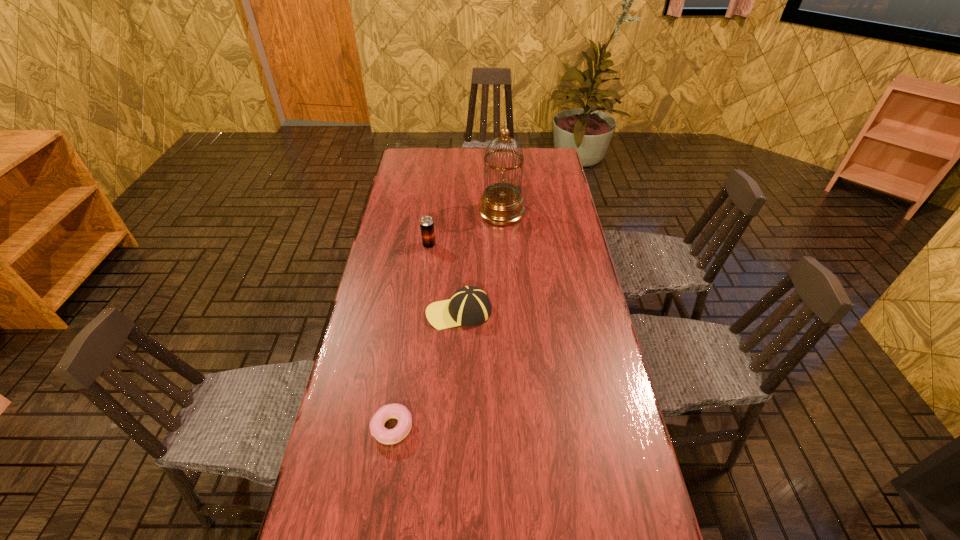
Find the location of `vacant space located 0.060m with an open door on the birdcage`. vacant space located 0.060m with an open door on the birdcage is located at coordinates click(464, 213).

The width and height of the screenshot is (960, 540). I want to click on vacant space located 0.370m on the right of the third shortest object, so click(537, 245).

The width and height of the screenshot is (960, 540). Find the location of `free point located 0.100m with the brim of the baseball cap facing forward`. free point located 0.100m with the brim of the baseball cap facing forward is located at coordinates (395, 312).

At what (x,y) coordinates should I click in order to perform the action: click on blank space located with the brim of the baseball cap facing forward. Please return your answer as a coordinate pair (x, y). Looking at the image, I should click on (407, 312).

This screenshot has width=960, height=540. I want to click on free space located with the brim of the baseball cap facing forward, so click(372, 312).

Identify the location of free space located on the back of the nearest object. (407, 330).

You are a GUI agent. You are given a task and a screenshot of the screen. Output one action in this format:
    pyautogui.click(x=<x>, y=<y>)
    Task: Click on the beer can that is positioned at the left edge
    
    Given the screenshot: What is the action you would take?
    pyautogui.click(x=426, y=223)

The width and height of the screenshot is (960, 540). I want to click on doughnut that is positioned at the left edge, so click(398, 411).

The width and height of the screenshot is (960, 540). What are the coordinates of `vacant space at the left edge of the desktop` in the screenshot? It's located at [396, 183].

The height and width of the screenshot is (540, 960). I want to click on vacant space at the right edge, so click(578, 296).